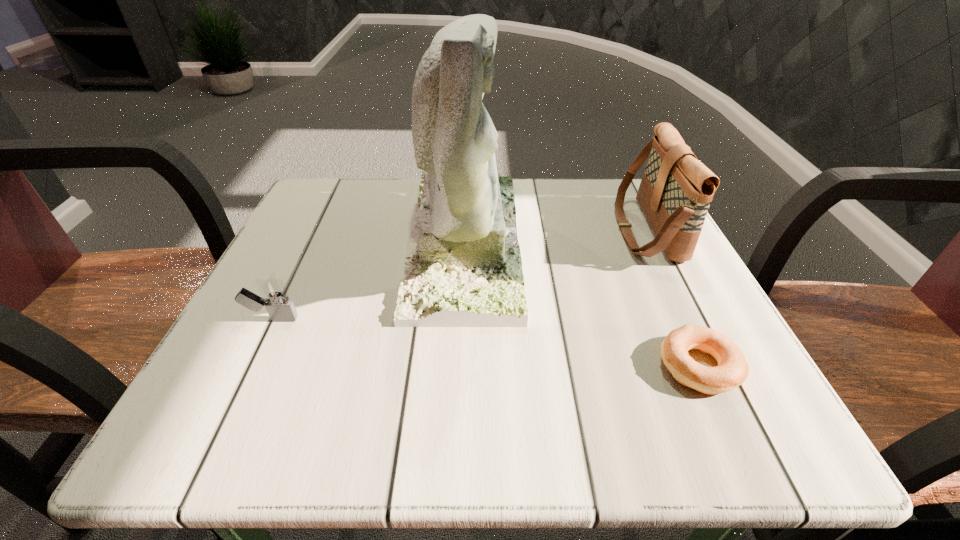
I want to click on object that is positioned at the near right corner, so click(732, 370).

I want to click on vacant space at the far edge of the desktop, so click(535, 192).

This screenshot has width=960, height=540. What are the coordinates of `free space at the near edge of the desktop` in the screenshot? It's located at (471, 397).

In the image, there is a desktop. Where is `vacant space at the left edge`? This screenshot has height=540, width=960. vacant space at the left edge is located at coordinates (268, 367).

The image size is (960, 540). Identify the location of free space at the right edge of the desktop. (708, 356).

The height and width of the screenshot is (540, 960). Identify the location of free space at the far left corner of the desktop. (333, 213).

Image resolution: width=960 pixels, height=540 pixels. I want to click on free region at the near left corner, so click(279, 394).

Where is `vacant space at the near right corner`? This screenshot has height=540, width=960. vacant space at the near right corner is located at coordinates (682, 429).

At what (x,y) coordinates should I click in order to perform the action: click on vacant area that lies between the tallest object and the igniter. Please return your answer as a coordinate pair (x, y). Looking at the image, I should click on (369, 280).

The image size is (960, 540). In order to click on vacant region between the second tallest object and the tallest object in this screenshot , I will do `click(555, 235)`.